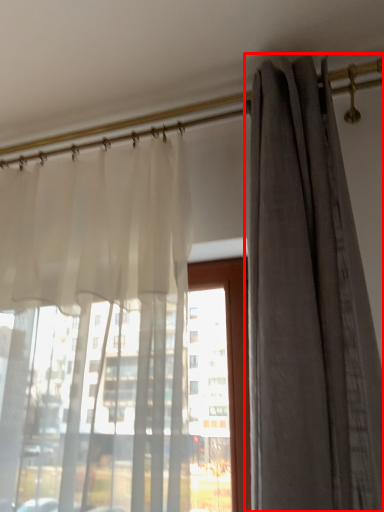
Question: From the image's perspective, what is the correct spatial positioning of curtain (annotated by the red box) in reference to curtain?

Choices:
 (A) below
 (B) above

Answer: (B)